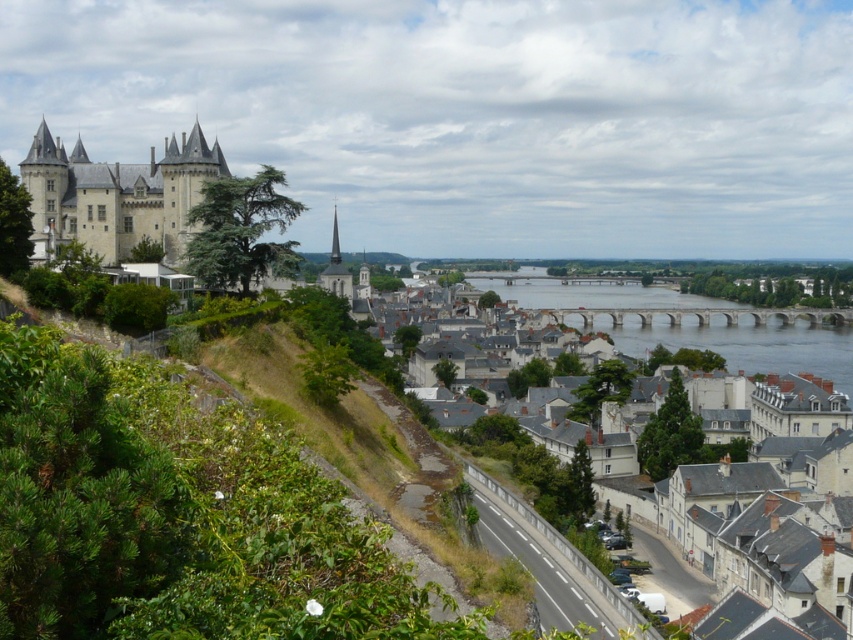
You are a tourist standing at the bottom of the hill looking up at the gray stone buildings at center and the smooth stone castle at upper left. Which structure would appear closer to you?

The gray stone buildings at center appear closer because they are positioned in front of the smooth stone castle at upper left.

You are standing at the point marked as point (115,195) in the image. What is the closest object to you?

The closest object to you is the smooth stone castle at upper left located at point (115,195).

You are a tour guide leading a group to the gray stone buildings at center and the brown stone bridge at center. Which one is wider when viewed from the road below?

The gray stone buildings at center are wider than the brown stone bridge at center.